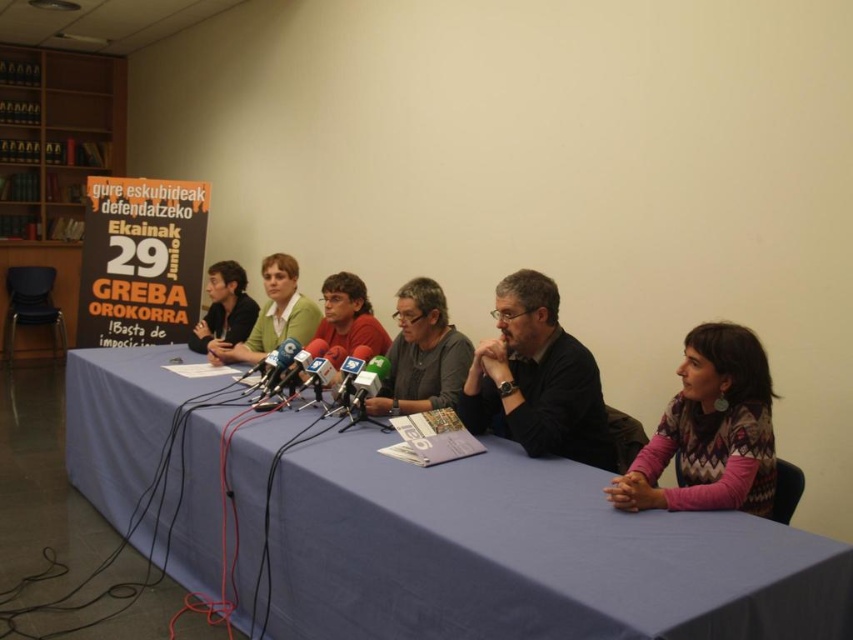
Who is lower down, green fabric shirt at center or matte black shirt at center?

Positioned lower is green fabric shirt at center.

Between green fabric shirt at center and matte black shirt at center, which one appears on the right side from the viewer's perspective?

Positioned to the right is green fabric shirt at center.

This screenshot has height=640, width=853. What do you see at coordinates (271, 316) in the screenshot?
I see `green fabric shirt at center` at bounding box center [271, 316].

You are a GUI agent. You are given a task and a screenshot of the screen. Output one action in this format:
    pyautogui.click(x=<x>, y=<y>)
    Task: Click on the green fabric shirt at center
    
    Given the screenshot: What is the action you would take?
    click(x=271, y=316)

Is knitted sweater at lower right positioned behind green fabric shirt at center?

No, knitted sweater at lower right is in front of green fabric shirt at center.

Between knitted sweater at lower right and green fabric shirt at center, which one has more height?

green fabric shirt at center is taller.

Find the location of a particular element. The height and width of the screenshot is (640, 853). knitted sweater at lower right is located at coordinates (711, 429).

This screenshot has height=640, width=853. What are the coordinates of `knitted sweater at lower right` in the screenshot? It's located at (711, 429).

Can you confirm if knitted sweater at lower right is positioned to the left of matte black shirt at center?

In fact, knitted sweater at lower right is to the right of matte black shirt at center.

Is point (727, 449) farther from viewer compared to point (202, 342)?

No.

Find the location of `knitted sweater at lower right`. knitted sweater at lower right is located at coordinates [x=711, y=429].

The image size is (853, 640). I want to click on knitted sweater at lower right, so click(x=711, y=429).